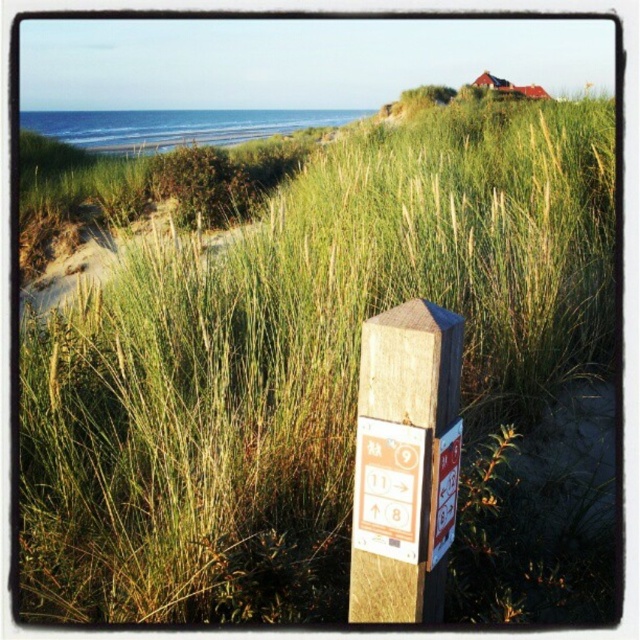
You are a hiker trying to read the trail information on the orange paper sign at center. Since the wooden post at center is blocking your view, can you move around it to get a better look?

The wooden post at center is larger in size compared to the orange paper sign at center, so it might block your view. You can move around the wooden post at center to get a better look at the orange paper sign at center.

You are standing at the point marked by the coordinates point (412, 365) in the coastal scene. What object are you directly at?

The point (412, 365) marks the wooden post at center, so you are directly at the wooden post at center.

You are a hiker who just arrived at the coastal area and see the wooden post at center and the orange paper sign at center. Which object is closer to you?

The wooden post at center is closer to you because it is in front of the orange paper sign at center.